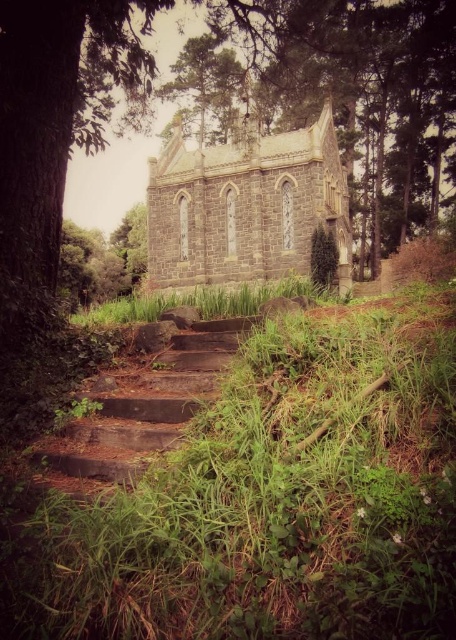
You are standing at the base of the stone steps leading to the chapel. A treasure map indicates that a hidden chest is buried at point (36, 532). Given that you can only move forward in a straight line from your current position, will you reach the chest before reaching the chapel steps?

The point (36, 532) is 30.28 meters away from you. Since the chapel steps are in front of you and the chest is located beyond that distance, you would reach the chapel steps before the chest.

You are a hiker who wants to take a photo of the dark gray stone church at center and the green textured pine tree at upper center. Based on their sizes, which one should you focus on to ensure both fit in the frame?

The dark gray stone church at center might be wider than the green textured pine tree at upper center, so focusing on the church would ensure both fit in the frame since it is wider.